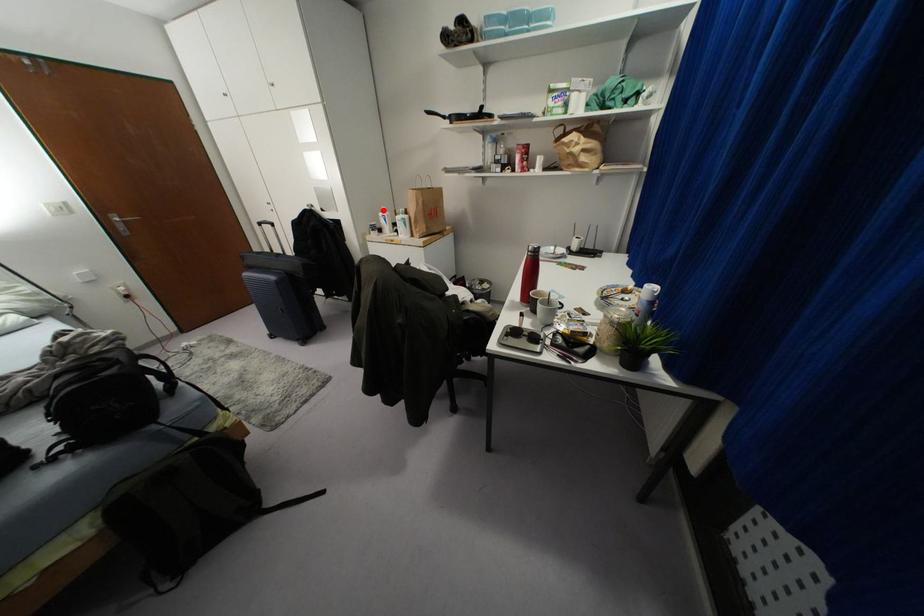
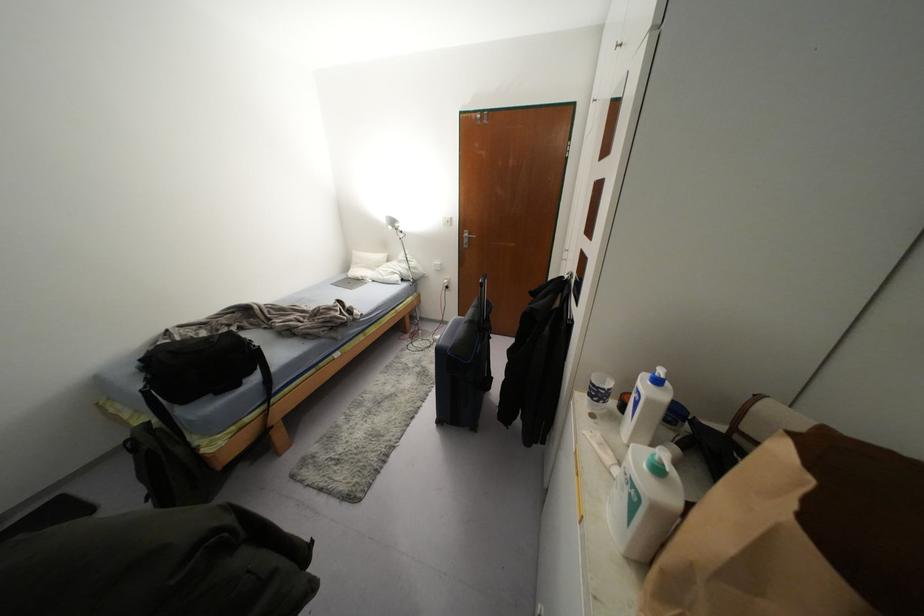
Where in the second image is the point corresponding to the highlighted location from the first image?

(658, 381)